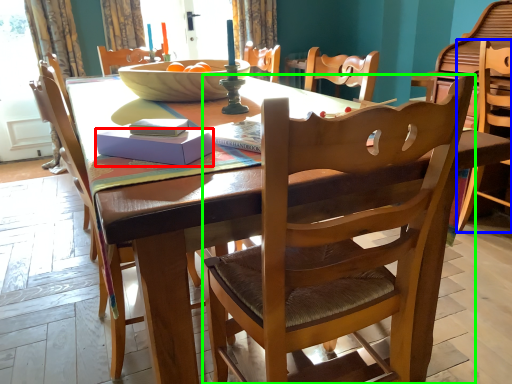
Question: Which is nearer to the box (highlighted by a red box)? chair (highlighted by a blue box) or chair (highlighted by a green box).

Choices:
 (A) chair
 (B) chair

Answer: (B)